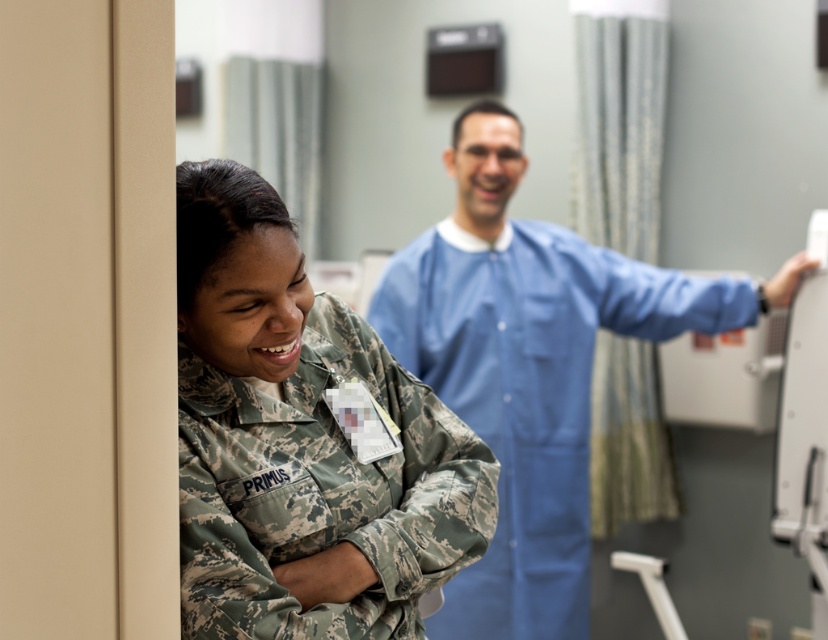
You are a patient in a hospital and need to locate the medical staff. You see a camouflage uniform at left and a blue smooth lab coat at center. Which one is closer to you?

The camouflage uniform at left is closer to you because it is in front of the blue smooth lab coat at center.